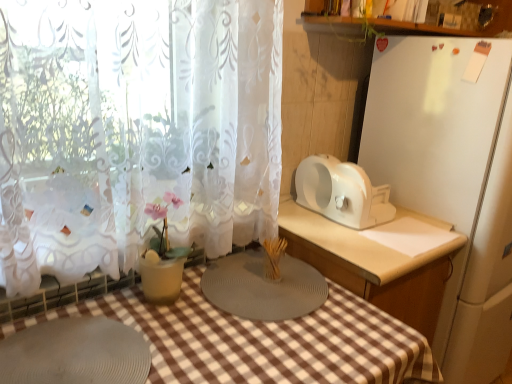
What is the approximate width of gray rubber placemat at center, which is the first appliance in left-to-right order?

gray rubber placemat at center, which is the first appliance in left-to-right order, is 15.72 inches wide.

The width and height of the screenshot is (512, 384). What do you see at coordinates (452, 181) in the screenshot?
I see `white plastic toaster at right, marked as the 3th appliance in a left-to-right arrangement` at bounding box center [452, 181].

Identify the location of gray rubber mat at lower left. This screenshot has width=512, height=384. (75, 353).

From the image's perspective, which one is positioned higher, gray rubber placemat at center, placed as the third appliance when sorted from right to left, or white plastic toaster at right, marked as the 3th appliance in a left-to-right arrangement?

white plastic toaster at right, marked as the 3th appliance in a left-to-right arrangement, is shown above in the image.

Could you measure the distance between gray rubber placemat at center, placed as the third appliance when sorted from right to left, and white plastic toaster at right, marked as the 3th appliance in a left-to-right arrangement?

A distance of 27.68 inches exists between gray rubber placemat at center, placed as the third appliance when sorted from right to left, and white plastic toaster at right, marked as the 3th appliance in a left-to-right arrangement.

Is gray rubber placemat at center, which is the first appliance in left-to-right order, shorter than white plastic toaster at right, which is the 1th appliance from right to left?

Yes, gray rubber placemat at center, which is the first appliance in left-to-right order, is shorter than white plastic toaster at right, which is the 1th appliance from right to left.

Would you consider gray rubber placemat at center, placed as the third appliance when sorted from right to left, to be distant from white plastic toaster at right, which is the 1th appliance from right to left?

That's not correct — gray rubber placemat at center, placed as the third appliance when sorted from right to left, is a little close to white plastic toaster at right, which is the 1th appliance from right to left.

Is white plastic toaster at right, positioned as the 2th appliance in left-to-right order, spatially inside gray rubber placemat at center, which is the first appliance in left-to-right order, or outside of it?

white plastic toaster at right, positioned as the 2th appliance in left-to-right order, is not inside gray rubber placemat at center, which is the first appliance in left-to-right order, it's outside.

From a real-world perspective, which object stands above the other?

white plastic toaster at right, the second appliance when ordered from right to left, from a real-world perspective.

Based on the photo, which of these two, white plastic toaster at right, the second appliance when ordered from right to left, or gray rubber placemat at center, placed as the third appliance when sorted from right to left, is wider?

Wider between the two is gray rubber placemat at center, placed as the third appliance when sorted from right to left.

How distant is white plastic toaster at right, the second appliance when ordered from right to left, from gray rubber placemat at center, which is the first appliance in left-to-right order?

white plastic toaster at right, the second appliance when ordered from right to left, is 15.06 inches from gray rubber placemat at center, which is the first appliance in left-to-right order.

Who is smaller, gray rubber placemat at center, placed as the third appliance when sorted from right to left, or white lace curtain at left?

gray rubber placemat at center, placed as the third appliance when sorted from right to left, is smaller.

Which object is thinner, gray rubber placemat at center, placed as the third appliance when sorted from right to left, or white lace curtain at left?

With smaller width is white lace curtain at left.

From the image's perspective, is gray rubber placemat at center, which is the first appliance in left-to-right order, located above white lace curtain at left?

Incorrect, from the image's perspective, gray rubber placemat at center, which is the first appliance in left-to-right order, is lower than white lace curtain at left.

In terms of width, does white lace curtain at left look wider or thinner when compared to gray rubber placemat at center, which is the first appliance in left-to-right order?

white lace curtain at left is thinner than gray rubber placemat at center, which is the first appliance in left-to-right order.

From a real-world perspective, which object rests below the other?

In real-world perspective, gray rubber placemat at center, placed as the third appliance when sorted from right to left, is lower.

Based on their sizes in the image, would you say white lace curtain at left is bigger or smaller than gray rubber placemat at center, which is the first appliance in left-to-right order?

Considering their sizes, white lace curtain at left takes up more space than gray rubber placemat at center, which is the first appliance in left-to-right order.

From the image's perspective, does white lace curtain at left appear lower than gray rubber placemat at center, which is the first appliance in left-to-right order?

Actually, white lace curtain at left appears above gray rubber placemat at center, which is the first appliance in left-to-right order, in the image.

Considering the sizes of objects gray rubber placemat at center, placed as the third appliance when sorted from right to left, and gray rubber mat at lower left in the image provided, who is thinner, gray rubber placemat at center, placed as the third appliance when sorted from right to left, or gray rubber mat at lower left?

gray rubber placemat at center, placed as the third appliance when sorted from right to left, is thinner.

From a real-world perspective, relative to gray rubber mat at lower left, is gray rubber placemat at center, which is the first appliance in left-to-right order, vertically above or below?

gray rubber placemat at center, which is the first appliance in left-to-right order, is situated higher than gray rubber mat at lower left in the real world.

Is gray rubber placemat at center, placed as the third appliance when sorted from right to left, next to gray rubber mat at lower left?

gray rubber placemat at center, placed as the third appliance when sorted from right to left, is not next to gray rubber mat at lower left, and they're not touching.

Is gray rubber placemat at center, which is the first appliance in left-to-right order, to the right of gray rubber mat at lower left from the viewer's perspective?

Yes.

Considering the positions of points (93, 153) and (362, 179), is point (93, 153) farther from camera compared to point (362, 179)?

No, it is not.

From the picture: From the image's perspective, is white lace curtain at left under white plastic toaster at right, positioned as the 2th appliance in left-to-right order?

No, from the image's perspective, white lace curtain at left is not below white plastic toaster at right, positioned as the 2th appliance in left-to-right order.

From a real-world perspective, is white lace curtain at left physically above white plastic toaster at right, positioned as the 2th appliance in left-to-right order?

Yes, from a real-world perspective, white lace curtain at left is over white plastic toaster at right, positioned as the 2th appliance in left-to-right order

Does white lace curtain at left appear on the left side of gray rubber mat at lower left?

No.

How different are the orientations of white lace curtain at left and gray rubber mat at lower left in degrees?

white lace curtain at left and gray rubber mat at lower left are facing 0.000355 degrees away from each other.

Is white lace curtain at left spatially inside gray rubber mat at lower left, or outside of it?

white lace curtain at left is not enclosed by gray rubber mat at lower left.

Could you tell me if white lace curtain at left is turned towards gray rubber mat at lower left?

Yes, white lace curtain at left is turned towards gray rubber mat at lower left.

From the image's perspective, which appliance is the 1st one above the gray rubber placemat at center, which is the first appliance in left-to-right order? Please provide its 2D coordinates.

[(452, 181)]

Starting from the gray rubber placemat at center, which is the first appliance in left-to-right order, which appliance is the 1st one to the right? Please provide its 2D coordinates.

[(342, 192)]

Estimate the real-world distances between objects in this image. Which object is closer to white plastic toaster at right, positioned as the 2th appliance in left-to-right order, white plastic toaster at right, which is the 1th appliance from right to left, or gray rubber placemat at center, placed as the third appliance when sorted from right to left?

white plastic toaster at right, which is the 1th appliance from right to left, is positioned closer to the anchor white plastic toaster at right, positioned as the 2th appliance in left-to-right order.

From the image, which object appears to be nearer to gray rubber placemat at center, which is the first appliance in left-to-right order, gray rubber mat at lower left or white plastic toaster at right, the second appliance when ordered from right to left?

white plastic toaster at right, the second appliance when ordered from right to left, is positioned closer to the anchor gray rubber placemat at center, which is the first appliance in left-to-right order.

From the image, which object appears to be farther from white plastic toaster at right, which is the 1th appliance from right to left, gray rubber mat at lower left or white lace curtain at left?

Among the two, gray rubber mat at lower left is located further to white plastic toaster at right, which is the 1th appliance from right to left.

Based on their spatial positions, is white plastic toaster at right, positioned as the 2th appliance in left-to-right order, or gray rubber placemat at center, which is the first appliance in left-to-right order, closer to white plastic toaster at right, marked as the 3th appliance in a left-to-right arrangement?

white plastic toaster at right, positioned as the 2th appliance in left-to-right order, is positioned closer to the anchor white plastic toaster at right, marked as the 3th appliance in a left-to-right arrangement.

Considering their positions, is white plastic toaster at right, marked as the 3th appliance in a left-to-right arrangement, positioned further to gray rubber mat at lower left than gray rubber placemat at center, placed as the third appliance when sorted from right to left?

The object further to gray rubber mat at lower left is white plastic toaster at right, marked as the 3th appliance in a left-to-right arrangement.

Estimate the real-world distances between objects in this image. Which object is further from white lace curtain at left, white plastic toaster at right, which is the 1th appliance from right to left, or gray rubber placemat at center, placed as the third appliance when sorted from right to left?

The object further to white lace curtain at left is white plastic toaster at right, which is the 1th appliance from right to left.

When comparing their distances from gray rubber placemat at center, which is the first appliance in left-to-right order, does white lace curtain at left or gray rubber mat at lower left seem closer?

white lace curtain at left lies closer to gray rubber placemat at center, which is the first appliance in left-to-right order, than the other object.

Estimate the real-world distances between objects in this image. Which object is closer to white plastic toaster at right, the second appliance when ordered from right to left, gray rubber placemat at center, which is the first appliance in left-to-right order, or white lace curtain at left?

gray rubber placemat at center, which is the first appliance in left-to-right order, lies closer to white plastic toaster at right, the second appliance when ordered from right to left, than the other object.

The image size is (512, 384). Identify the location of appliance located between gray rubber placemat at center, placed as the third appliance when sorted from right to left, and white plastic toaster at right, marked as the 3th appliance in a left-to-right arrangement, in the left-right direction. (342, 192).

The width and height of the screenshot is (512, 384). I want to click on curtain between gray rubber mat at lower left and white plastic toaster at right, marked as the 3th appliance in a left-to-right arrangement, so click(x=134, y=130).

Identify the location of curtain between gray rubber mat at lower left and white plastic toaster at right, positioned as the 2th appliance in left-to-right order, from left to right. (134, 130).

This screenshot has height=384, width=512. I want to click on appliance situated between gray rubber mat at lower left and white plastic toaster at right, the second appliance when ordered from right to left, from left to right, so click(263, 287).